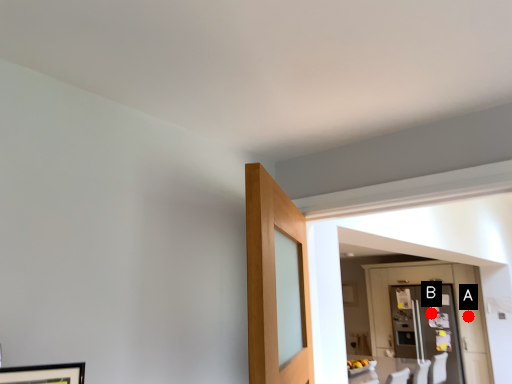
Question: Two points are circled on the image, labeled by A and B beside each circle. Which point is closer to the camera taking this photo?

Choices:
 (A) A is closer
 (B) B is closer

Answer: (A)